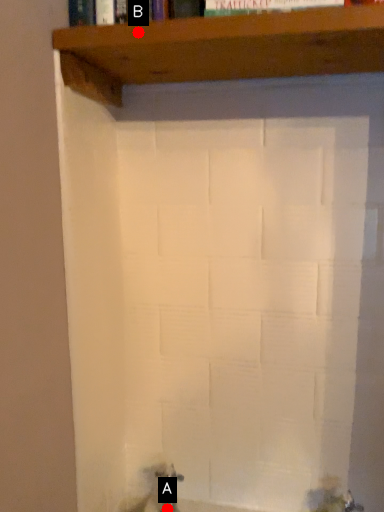
Question: Two points are circled on the image, labeled by A and B beside each circle. Among these points, which one is nearest to the camera?

Choices:
 (A) A is closer
 (B) B is closer

Answer: (B)